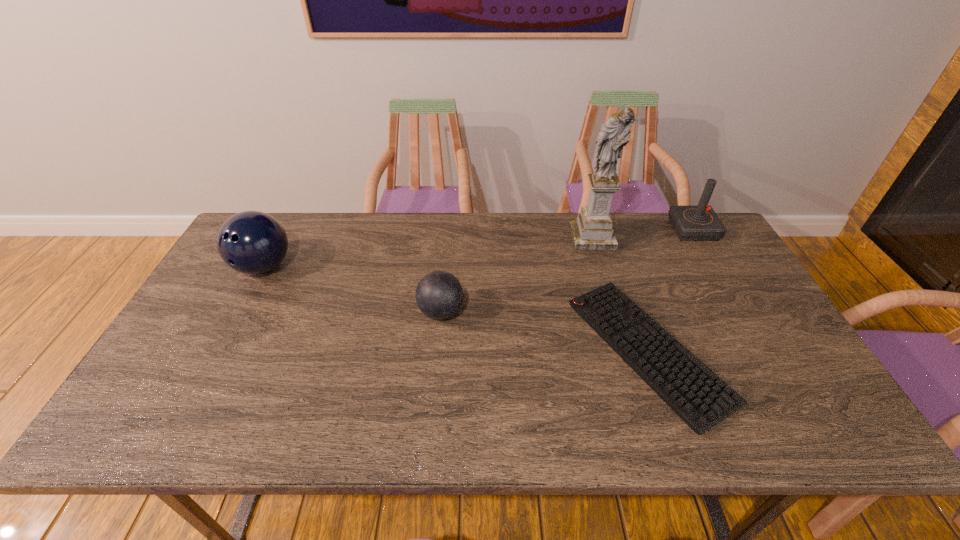
The height and width of the screenshot is (540, 960). What are the coordinates of `free region that satisfies the following two spatial constraints: 1. on the front-facing side of the sculpture; 2. on the grip area of the fourth tallest object` in the screenshot? It's located at (614, 312).

At what (x,y) coordinates should I click in order to perform the action: click on free point that satisfies the following two spatial constraints: 1. on the grip area of the second object from left to right; 2. on the right side of the computer keyboard. Please return your answer as a coordinate pair (x, y). The width and height of the screenshot is (960, 540). Looking at the image, I should click on (438, 351).

The width and height of the screenshot is (960, 540). Identify the location of free location that satisfies the following two spatial constraints: 1. on the rectangular base of the rightmost object; 2. on the front-facing side of the tallest object. (697, 237).

At what (x,y) coordinates should I click in order to perform the action: click on free space that satisfies the following two spatial constraints: 1. on the grip area of the shortest object; 2. on the right side of the shorter bowling ball. Please return your answer as a coordinate pair (x, y). This screenshot has height=540, width=960. Looking at the image, I should click on (438, 351).

Find the location of `free location that satisfies the following two spatial constraints: 1. on the rectangular base of the joystick; 2. on the surface of the taller bowling ball near the finger holes`. free location that satisfies the following two spatial constraints: 1. on the rectangular base of the joystick; 2. on the surface of the taller bowling ball near the finger holes is located at coordinates (714, 267).